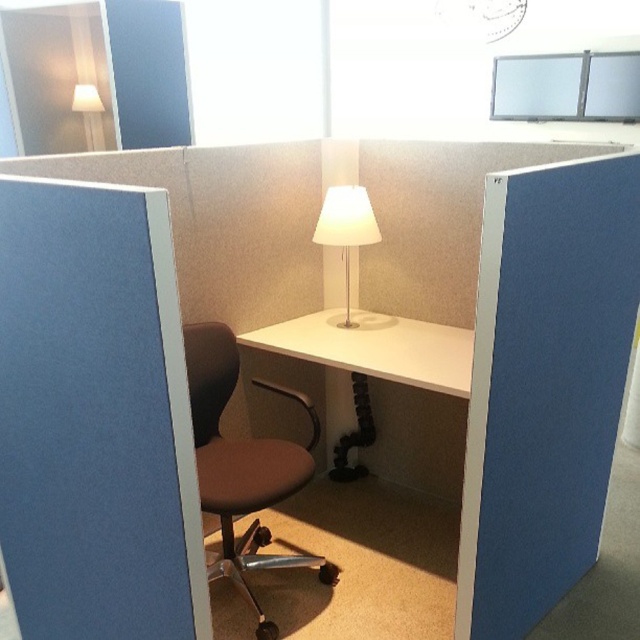
Question: Which of the following is the farthest from the observer?

Choices:
 (A) brown fabric swivel chair at center
 (B) white glossy computer desk at center

Answer: (B)

Question: Among these objects, which one is nearest to the camera?

Choices:
 (A) brown fabric swivel chair at center
 (B) white glossy computer desk at center
 (C) white matte lamp at center

Answer: (A)

Question: Is brown fabric swivel chair at center thinner than white glossy computer desk at center?

Choices:
 (A) yes
 (B) no

Answer: (A)

Question: Is brown fabric swivel chair at center further to camera compared to white matte lamp at center?

Choices:
 (A) yes
 (B) no

Answer: (B)

Question: Which of the following is the closest to the observer?

Choices:
 (A) (244, 532)
 (B) (404, 336)
 (C) (355, 220)

Answer: (C)

Question: Can you confirm if white glossy computer desk at center is positioned to the left of white matte lamp at center?

Choices:
 (A) yes
 (B) no

Answer: (B)